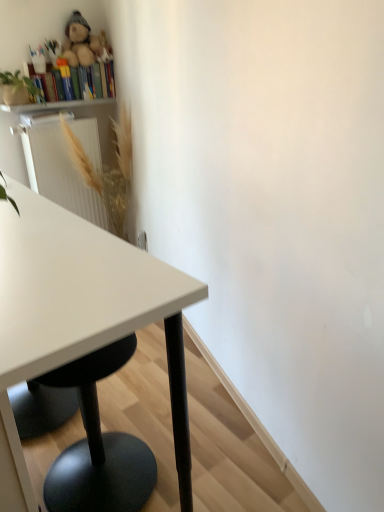
This screenshot has height=512, width=384. I want to click on free space above multicolored cardboard books at upper left (from a real-world perspective), so click(x=81, y=58).